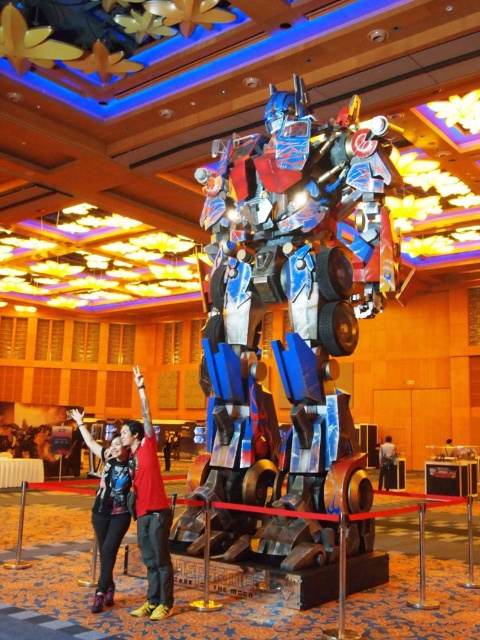
Question: Based on their relative distances, which object is farther from the matte black jacket at lower left?

Choices:
 (A) metallic silver suit at center
 (B) metallic red shirt at center
 (C) red shirt at center
 (D) metallic blue transformer at center

Answer: (B)

Question: Based on their relative distances, which object is farther from the metallic silver suit at center?

Choices:
 (A) metallic red shirt at center
 (B) metallic blue transformer at center
 (C) matte black jacket at lower left

Answer: (C)

Question: Can you confirm if red shirt at center is positioned to the left of metallic silver suit at center?

Choices:
 (A) no
 (B) yes

Answer: (B)

Question: Does red shirt at center lie in front of metallic red shirt at center?

Choices:
 (A) no
 (B) yes

Answer: (B)

Question: Considering the relative positions of metallic blue transformer at center and metallic red shirt at center in the image provided, where is metallic blue transformer at center located with respect to metallic red shirt at center?

Choices:
 (A) left
 (B) right

Answer: (B)

Question: Which point is closer to the camera?

Choices:
 (A) (391, 452)
 (B) (170, 445)
 (C) (72, 410)

Answer: (C)